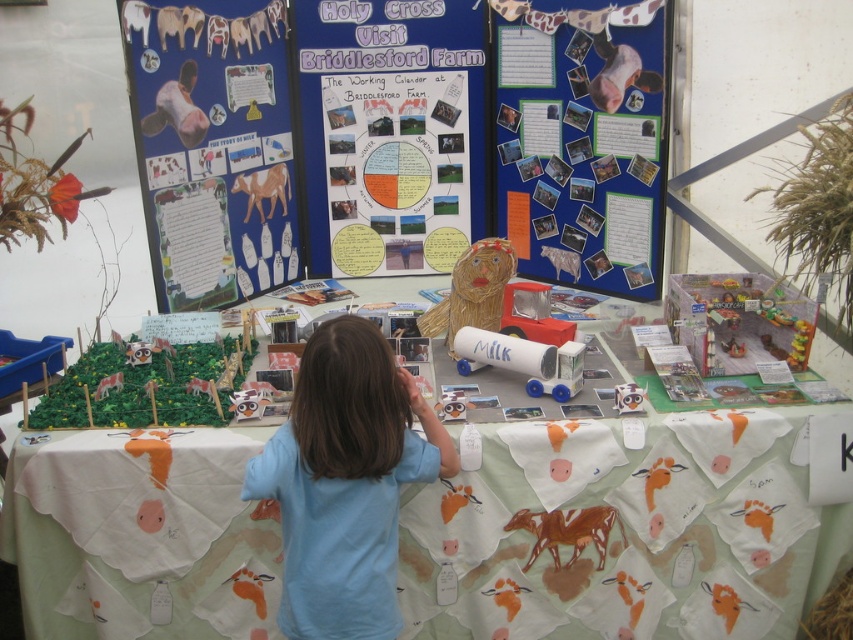
Question: Is white paper with cow prints at center bigger than white paper poster at center?

Choices:
 (A) no
 (B) yes

Answer: (B)

Question: Can you confirm if brown matte cow at center is thinner than light brown paper horse at center?

Choices:
 (A) no
 (B) yes

Answer: (A)

Question: Considering the real-world distances, which object is farthest from the brown matte cow at center?

Choices:
 (A) white paper poster at center
 (B) woven straw lion at center

Answer: (A)

Question: Does blue paperboard at upper right come behind woven straw lion at center?

Choices:
 (A) no
 (B) yes

Answer: (B)

Question: Estimate the real-world distances between objects in this image. Which object is farther from the woven straw lion at center?

Choices:
 (A) brown matte cow at center
 (B) white paper poster at center

Answer: (B)

Question: Which of these objects is positioned farthest from the woven straw lion at center?

Choices:
 (A) white paper with cow prints at center
 (B) blue paperboard at upper right
 (C) white paper poster at center

Answer: (C)